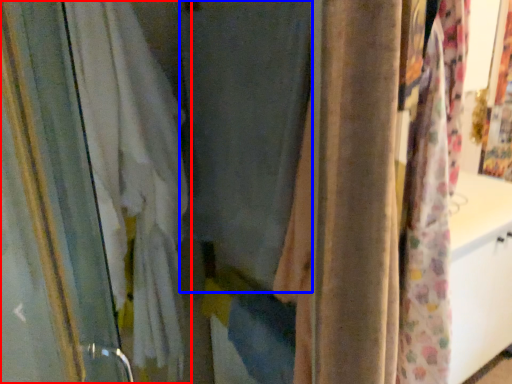
Question: Which object appears farthest to the camera in this image, curtain (highlighted by a red box) or curtain (highlighted by a blue box)?

Choices:
 (A) curtain
 (B) curtain

Answer: (A)